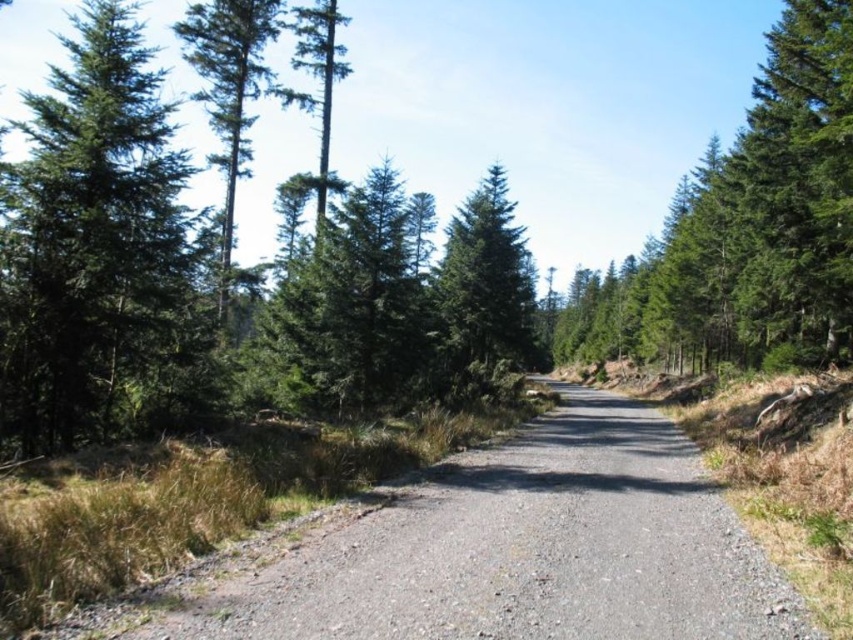
Does gray gravel road at center have a lesser width compared to green matte tree at upper right?

Yes, gray gravel road at center is thinner than green matte tree at upper right.

Is gray gravel road at center below green matte tree at upper right?

Yes, gray gravel road at center is below green matte tree at upper right.

Is point (769, 570) closer to viewer compared to point (664, 278)?

Yes, point (769, 570) is closer to viewer.

Locate an element on the screen. This screenshot has height=640, width=853. gray gravel road at center is located at coordinates (521, 548).

Between gray gravel road at center and green matte tree at left, which one appears on the left side from the viewer's perspective?

green matte tree at left

Does gray gravel road at center appear on the right side of green matte tree at left?

Indeed, gray gravel road at center is positioned on the right side of green matte tree at left.

Which is behind, point (554, 452) or point (109, 372)?

Point (554, 452)

This screenshot has height=640, width=853. I want to click on gray gravel road at center, so click(x=521, y=548).

Between point (67, 209) and point (480, 369), which one is positioned behind?

Positioned behind is point (480, 369).

Can you confirm if green matte tree at left is positioned below green matte tree at center?

Incorrect, green matte tree at left is not positioned below green matte tree at center.

The width and height of the screenshot is (853, 640). What do you see at coordinates (91, 237) in the screenshot? I see `green matte tree at left` at bounding box center [91, 237].

The width and height of the screenshot is (853, 640). Identify the location of green matte tree at left. (91, 237).